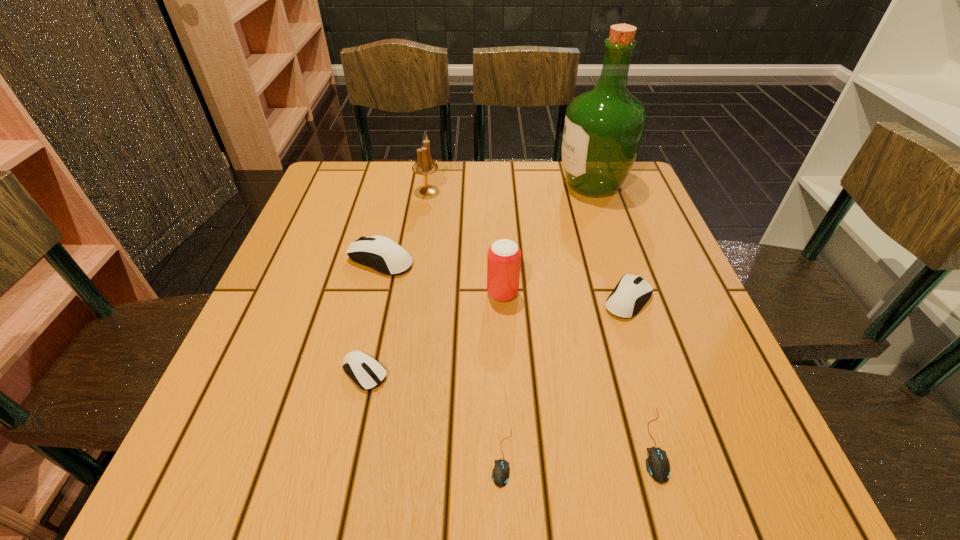
Image resolution: width=960 pixels, height=540 pixels. Find the location of `the tallest object`. the tallest object is located at coordinates (603, 130).

You are a GUI agent. You are given a task and a screenshot of the screen. Output one action in this format:
    pyautogui.click(x=<x>, y=<y>)
    Task: Click on the green liquor
    Image resolution: width=960 pixels, height=540 pixels.
    Given the screenshot: What is the action you would take?
    pyautogui.click(x=603, y=130)

You are a GUI agent. You are given a task and a screenshot of the screen. Output one action in this format:
    pyautogui.click(x=<x>, y=<y>)
    Task: Click on the candle holder
    Image resolution: width=960 pixels, height=540 pixels.
    Given the screenshot: What is the action you would take?
    click(425, 166)

This screenshot has width=960, height=540. Find the location of `beer can`. beer can is located at coordinates [504, 256].

The width and height of the screenshot is (960, 540). What are the coordinates of `red beer can` in the screenshot? It's located at (504, 256).

You are a GUI agent. You are given a task and a screenshot of the screen. Output one action in this format:
    pyautogui.click(x=<x>, y=<y>)
    Task: Click on the sixth nearest object
    The width and height of the screenshot is (960, 540).
    Given the screenshot: What is the action you would take?
    pyautogui.click(x=380, y=253)

Find the location of a particular element. This screenshot has width=960, height=540. the fifth shortest object is located at coordinates (380, 253).

Find the location of a particular element. the rightmost white mouse is located at coordinates (632, 292).

This screenshot has width=960, height=540. In order to click on the second biggest white mouse in this screenshot , I will do `click(632, 292)`.

This screenshot has width=960, height=540. Identify the location of the third tallest mouse. (367, 373).